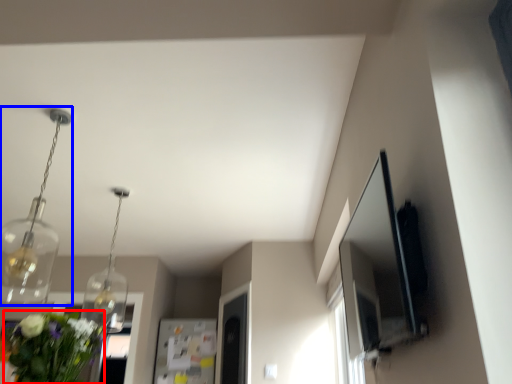
Question: Which point is further to the camera, floral arrangement (highlighted by a red box) or light fixture (highlighted by a blue box)?

Choices:
 (A) floral arrangement
 (B) light fixture

Answer: (B)